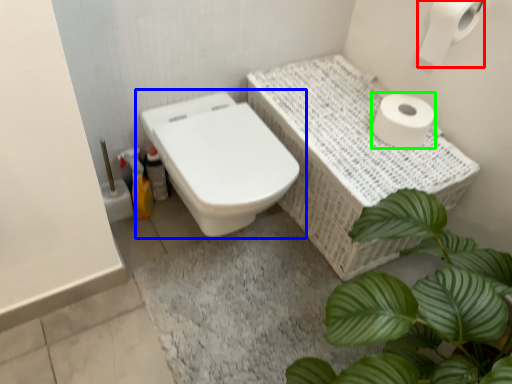
Question: Which is farther away from toilet paper (highlighted by a red box)? toilet (highlighted by a blue box) or toilet paper (highlighted by a green box)?

Choices:
 (A) toilet
 (B) toilet paper

Answer: (A)